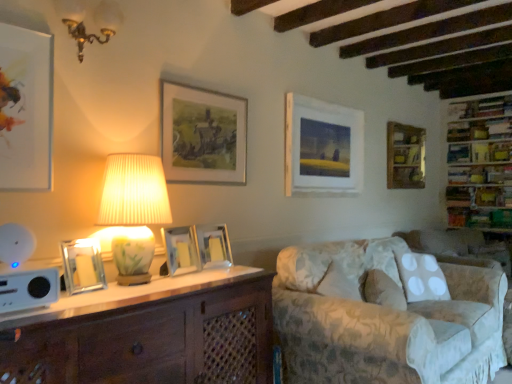
Question: Does transparent glass picture frame at left, which is counted as the 6th picture frame, starting from the back, have a lesser height compared to white plastic speaker at lower left?

Choices:
 (A) no
 (B) yes

Answer: (A)

Question: Is transparent glass picture frame at left, positioned as the 6th picture frame in right-to-left order, facing away from white plastic speaker at lower left?

Choices:
 (A) no
 (B) yes

Answer: (A)

Question: Is transparent glass picture frame at left, which appears as the second picture frame when viewed from the front, to the left of white plastic speaker at lower left from the viewer's perspective?

Choices:
 (A) yes
 (B) no

Answer: (B)

Question: Is the position of transparent glass picture frame at left, which is counted as the 2th picture frame, starting from the left, more distant than that of white plastic speaker at lower left?

Choices:
 (A) no
 (B) yes

Answer: (B)

Question: From a real-world perspective, is transparent glass picture frame at left, positioned as the 6th picture frame in right-to-left order, located beneath white plastic speaker at lower left?

Choices:
 (A) no
 (B) yes

Answer: (A)

Question: Could you tell me if transparent glass picture frame at left, which is counted as the 2th picture frame, starting from the left, is turned towards white plastic speaker at lower left?

Choices:
 (A) yes
 (B) no

Answer: (B)

Question: Is matte glass picture frame at center, placed as the 3th picture frame when sorted from front to back, bigger than silver metallic picture frame at center, acting as the fourth picture frame starting from the back?

Choices:
 (A) yes
 (B) no

Answer: (A)

Question: Would you consider matte glass picture frame at center, which is the fifth picture frame from right to left, to be distant from silver metallic picture frame at center, acting as the fourth picture frame starting from the back?

Choices:
 (A) yes
 (B) no

Answer: (B)

Question: Does matte glass picture frame at center, placed as the 3th picture frame when sorted from front to back, contain silver metallic picture frame at center, which is the 5th picture frame from left to right?

Choices:
 (A) yes
 (B) no

Answer: (B)

Question: Is matte glass picture frame at center, the 3th picture frame viewed from the left, at the left side of silver metallic picture frame at center, acting as the fourth picture frame starting from the back?

Choices:
 (A) yes
 (B) no

Answer: (A)

Question: Is matte glass picture frame at center, marked as the 5th picture frame in a back-to-front arrangement, completely or partially outside of silver metallic picture frame at center, the third picture frame when ordered from right to left?

Choices:
 (A) no
 (B) yes

Answer: (B)

Question: From the image's perspective, would you say matte glass picture frame at center, which is the fifth picture frame from right to left, is shown under silver metallic picture frame at center, the third picture frame when ordered from right to left?

Choices:
 (A) yes
 (B) no

Answer: (A)

Question: Considering the relative sizes of matte white picture frame at upper left, which is the 1th picture frame from front to back, and fluffy white pillow at lower right in the image provided, is matte white picture frame at upper left, which is the 1th picture frame from front to back, smaller than fluffy white pillow at lower right?

Choices:
 (A) yes
 (B) no

Answer: (A)